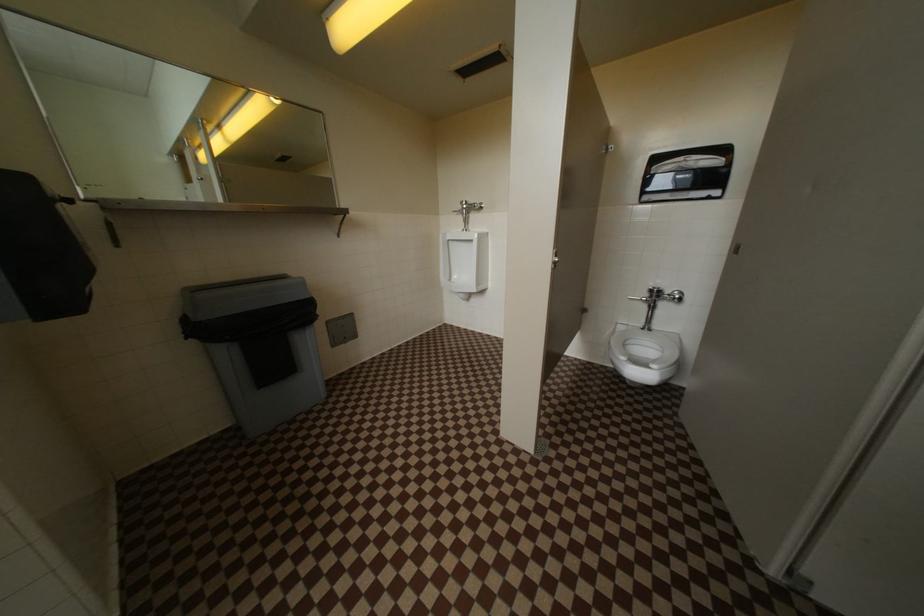
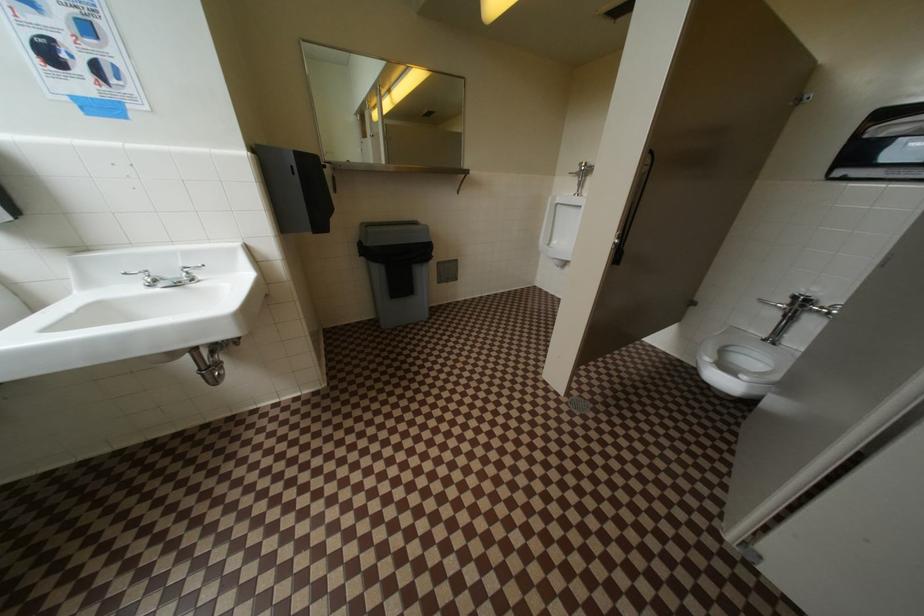
Question: How did the camera likely rotate?

Choices:
 (A) Left
 (B) Right
 (C) Up
 (D) Down

Answer: (A)